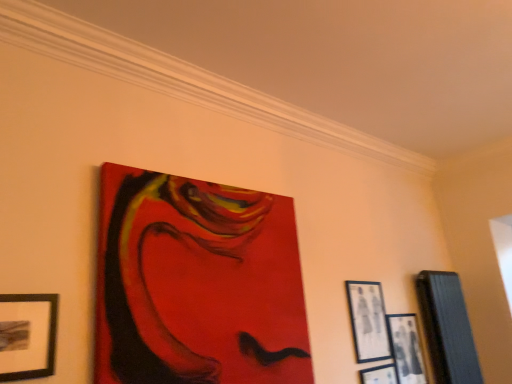
Question: Is matte acrylic painting at upper center, which is counted as the first picture frame, starting from the left, shorter than wooden picture frame at right, which is the 1th picture frame in right-to-left order?

Choices:
 (A) no
 (B) yes

Answer: (A)

Question: Is matte acrylic painting at upper center, which is counted as the first picture frame, starting from the left, closer to the viewer compared to wooden picture frame at right, which is the 5th picture frame in left-to-right order?

Choices:
 (A) no
 (B) yes

Answer: (B)

Question: Considering the relative sizes of matte acrylic painting at upper center, which is counted as the first picture frame, starting from the left, and wooden picture frame at right, which is the 1th picture frame in right-to-left order, in the image provided, is matte acrylic painting at upper center, which is counted as the first picture frame, starting from the left, thinner than wooden picture frame at right, which is the 1th picture frame in right-to-left order,?

Choices:
 (A) no
 (B) yes

Answer: (A)

Question: Could you tell me if matte acrylic painting at upper center, marked as the 5th picture frame in a right-to-left arrangement, is facing wooden picture frame at right, which is the 1th picture frame in right-to-left order?

Choices:
 (A) no
 (B) yes

Answer: (A)

Question: Is matte acrylic painting at upper center, which is counted as the first picture frame, starting from the left, far from wooden picture frame at right, which is the 1th picture frame in right-to-left order?

Choices:
 (A) yes
 (B) no

Answer: (A)

Question: Is wooden picture frame at right, which is the 1th picture frame in right-to-left order, situated inside matte black picture frame at lower right, which is the 3th picture frame from right to left, or outside?

Choices:
 (A) outside
 (B) inside

Answer: (A)

Question: In the image, is wooden picture frame at right, which is the 1th picture frame in right-to-left order, positioned in front of or behind matte black picture frame at lower right, which is the 3th picture frame from right to left?

Choices:
 (A) behind
 (B) front

Answer: (A)

Question: Looking at the image, does wooden picture frame at right, which is the 1th picture frame in right-to-left order, seem bigger or smaller compared to matte black picture frame at lower right, which appears as the third picture frame when viewed from the left?

Choices:
 (A) small
 (B) big

Answer: (B)

Question: In the image, is wooden picture frame at right, which is the 5th picture frame in left-to-right order, on the left side or the right side of matte black picture frame at lower right, which appears as the third picture frame when viewed from the left?

Choices:
 (A) left
 (B) right

Answer: (B)

Question: Looking at their shapes, would you say matte acrylic painting at upper center, which is counted as the first picture frame, starting from the left, is wider or thinner than wooden picture frame at right, which is the 1th picture frame in right-to-left order?

Choices:
 (A) thin
 (B) wide

Answer: (B)

Question: Would you say matte acrylic painting at upper center, marked as the 5th picture frame in a right-to-left arrangement, is inside or outside wooden picture frame at right, which is the 5th picture frame in left-to-right order?

Choices:
 (A) outside
 (B) inside

Answer: (A)

Question: From a real-world perspective, is matte acrylic painting at upper center, marked as the 5th picture frame in a right-to-left arrangement, positioned above or below wooden picture frame at right, which is the 5th picture frame in left-to-right order?

Choices:
 (A) above
 (B) below

Answer: (A)

Question: Considering the positions of point (102, 349) and point (465, 336), is point (102, 349) closer or farther from the camera than point (465, 336)?

Choices:
 (A) closer
 (B) farther

Answer: (A)

Question: Choose the correct answer: Is black matte picture frame at lower right, positioned as the 2th picture frame in right-to-left order, inside wooden picture frame at right, which is the 1th picture frame in right-to-left order, or outside it?

Choices:
 (A) inside
 (B) outside

Answer: (B)

Question: From a real-world perspective, is black matte picture frame at lower right, positioned as the 2th picture frame in right-to-left order, physically located above or below wooden picture frame at right, which is the 5th picture frame in left-to-right order?

Choices:
 (A) above
 (B) below

Answer: (B)